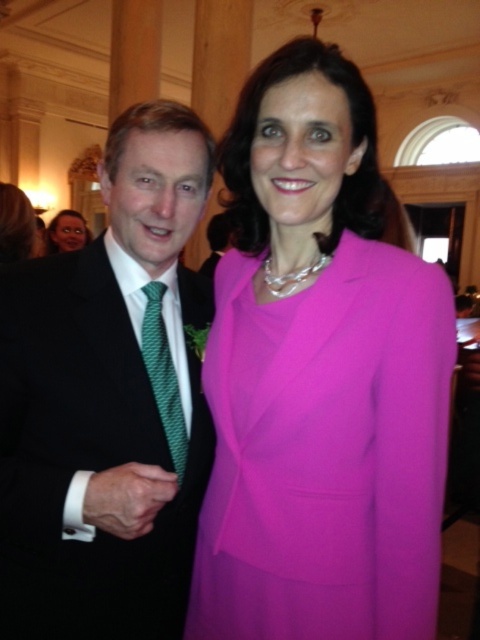
Question: Which point is closer to the camera taking this photo?

Choices:
 (A) click(190, 388)
 (B) click(142, 333)
 (C) click(76, 228)
 (D) click(336, 177)

Answer: (D)

Question: Can you confirm if matte black suit at left is positioned below matte black face at upper left?

Choices:
 (A) yes
 (B) no

Answer: (A)

Question: Which of the following is the farthest from the observer?

Choices:
 (A) matte black face at upper left
 (B) matte black suit at left

Answer: (A)

Question: Where is matte pink suit at center located in relation to green textured tie at left in the image?

Choices:
 (A) above
 (B) below

Answer: (A)

Question: Is matte black suit at left behind matte black face at upper left?

Choices:
 (A) no
 (B) yes

Answer: (A)

Question: Which is farther from the matte black face at upper left?

Choices:
 (A) green textured tie at left
 (B) matte pink suit at center

Answer: (B)